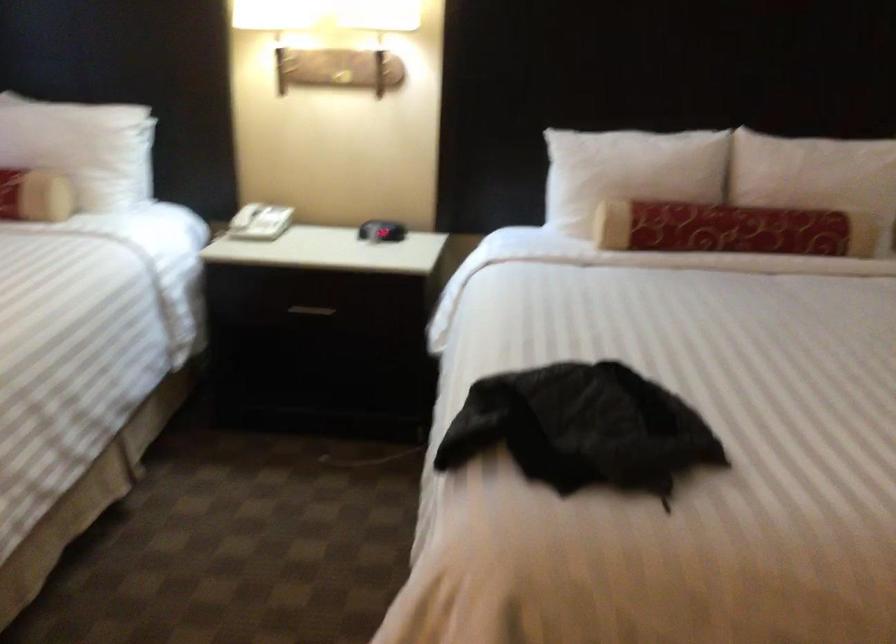
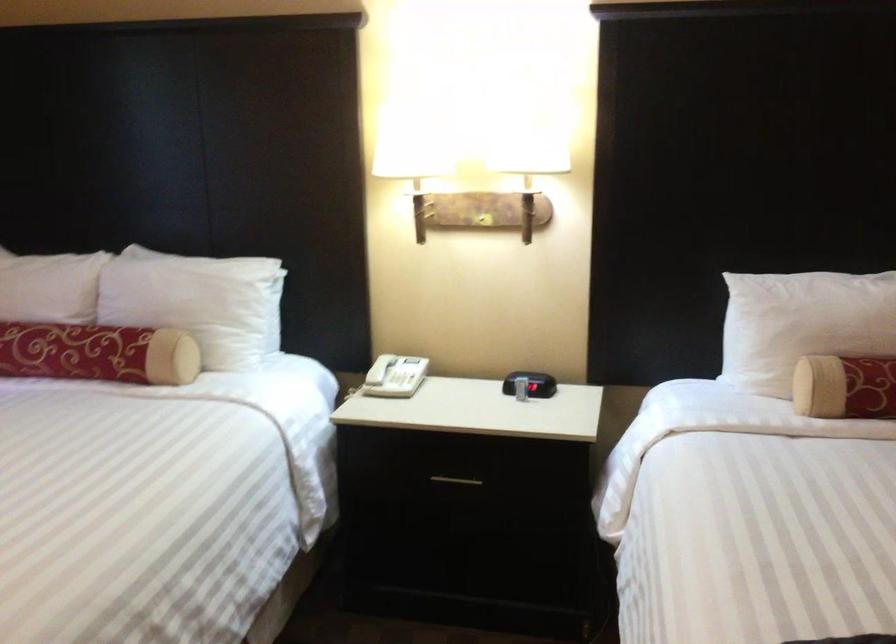
In the second image, find the point that corresponds to (x=604, y=174) in the first image.

(802, 324)